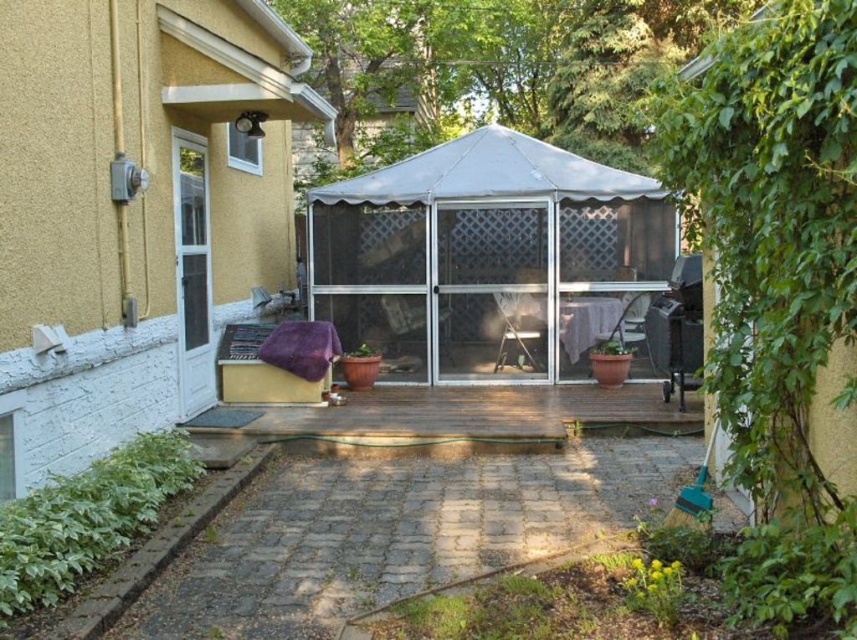
Question: Based on their relative distances, which object is farther from the white fabric canopy at center?

Choices:
 (A) purple fabric at lower center
 (B) white painted wood glass door at left

Answer: (A)

Question: Which point is farther to the camera?

Choices:
 (A) (454, 404)
 (B) (440, 394)
 (C) (444, 294)
 (D) (195, 316)

Answer: (C)

Question: Based on their relative distances, which object is farther from the white painted wood glass door at left?

Choices:
 (A) purple fabric at lower center
 (B) brown wooden deck at center
 (C) wooden deck at center

Answer: (B)

Question: Is purple fabric at lower center below white fabric canopy at center?

Choices:
 (A) no
 (B) yes

Answer: (B)

Question: Can you confirm if wooden deck at center is positioned above white fabric canopy at center?

Choices:
 (A) no
 (B) yes

Answer: (A)

Question: Is purple fabric at lower center smaller than white fabric canopy at center?

Choices:
 (A) no
 (B) yes

Answer: (B)